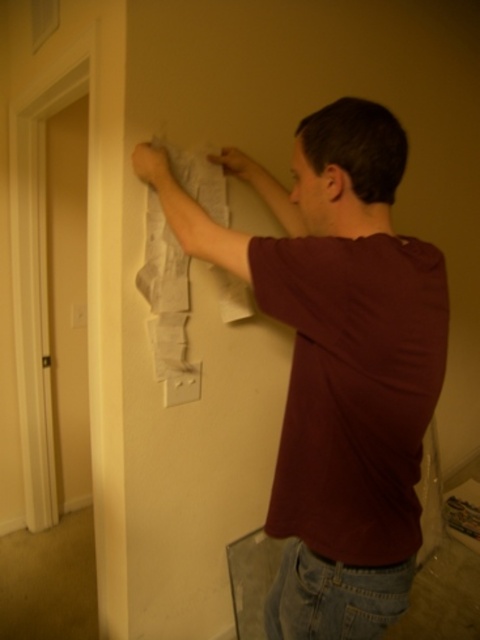
Does maroon cotton t-shirt at center come in front of white paper at upper center?

That is True.

Between maroon cotton t-shirt at center and white paper at upper center, which one is positioned lower?

Positioned lower is maroon cotton t-shirt at center.

Who is more forward, (297, 376) or (175, 160)?

Point (297, 376) is more forward.

The image size is (480, 640). Identify the location of maroon cotton t-shirt at center. (354, 387).

Can you confirm if maroon t-shirt at center is shorter than maroon cotton t-shirt at center?

No, maroon t-shirt at center is not shorter than maroon cotton t-shirt at center.

Between maroon t-shirt at center and maroon cotton t-shirt at center, which one has more height?

maroon t-shirt at center

Is point (424, 417) more distant than point (422, 403)?

Yes, it is.

At what (x,y) coordinates should I click in order to perform the action: click on maroon t-shirt at center. Please return your answer as a coordinate pair (x, y). The width and height of the screenshot is (480, 640). Looking at the image, I should click on (336, 362).

Is maroon t-shirt at center bigger than white paper at upper center?

Yes, maroon t-shirt at center is bigger than white paper at upper center.

What do you see at coordinates (336, 362) in the screenshot? I see `maroon t-shirt at center` at bounding box center [336, 362].

In order to click on maroon t-shirt at center in this screenshot , I will do `click(336, 362)`.